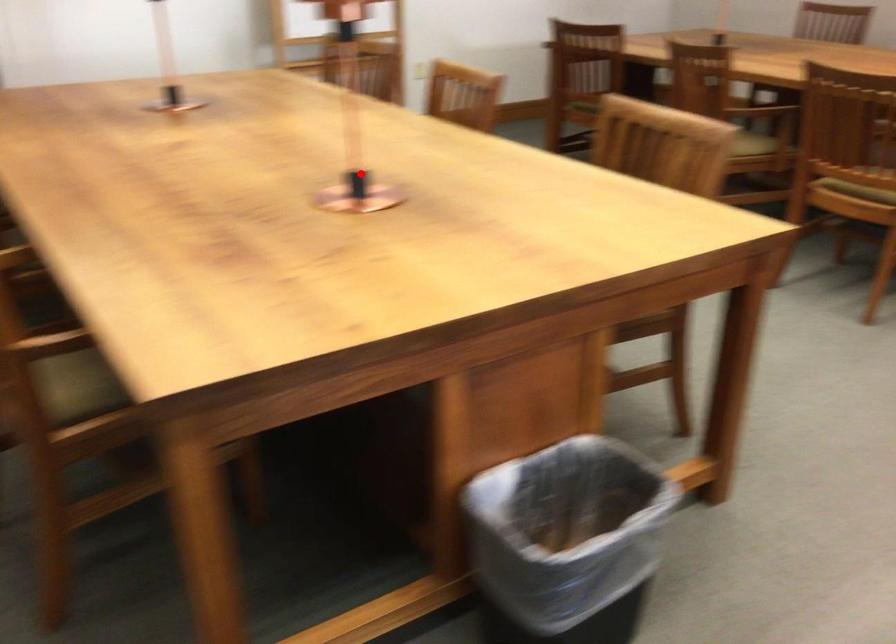
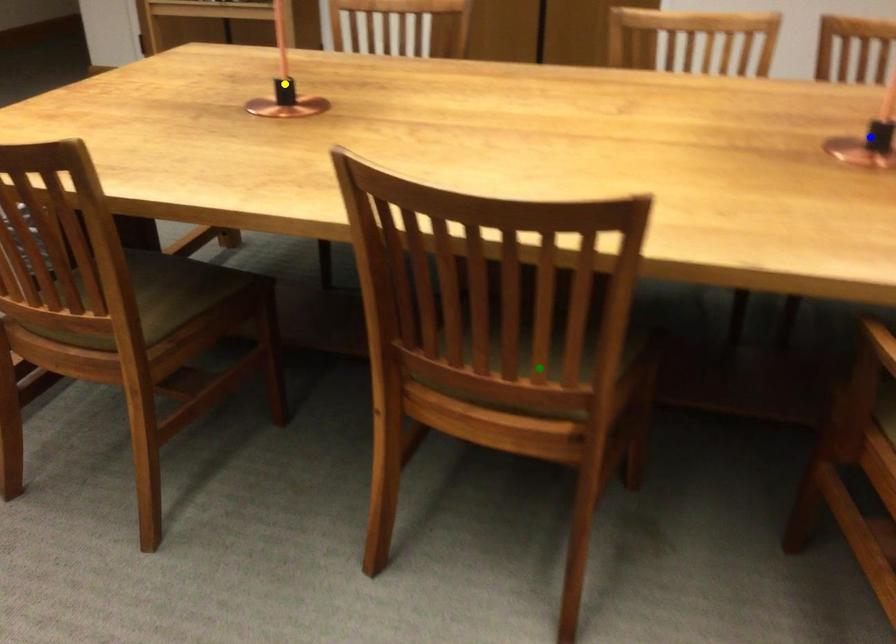
Question: I am providing you with two images of the same scene from different viewpoints. A red point is marked on the first image. You are given multiple points on the second image. In image 2, which mark is for the same physical point as the one in image 1?

Choices:
 (A) yellow point
 (B) blue point
 (C) green point

Answer: (A)